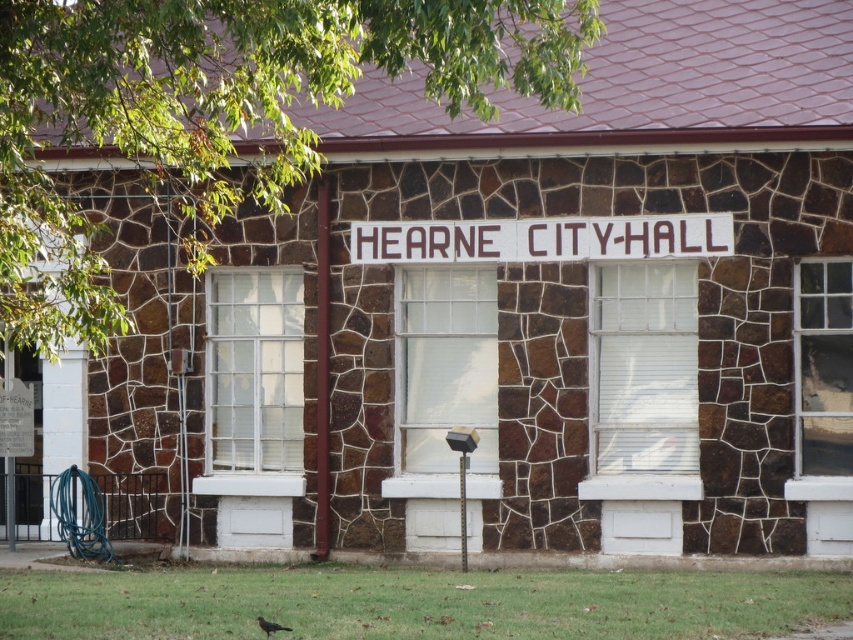
You are standing in front of the HEARNE CITY HALL building. You notice two points marked on the building. Which point is closer to you, point at (668, 477) or point at (567, 228)?

Point at (668, 477) is closer to the viewer than point at (567, 228).

You are standing in front of HEARNE CITY HALL. There is a point marked at coordinates (254, 381). What object does this point correspond to?

The point corresponds to the white glass window at center.